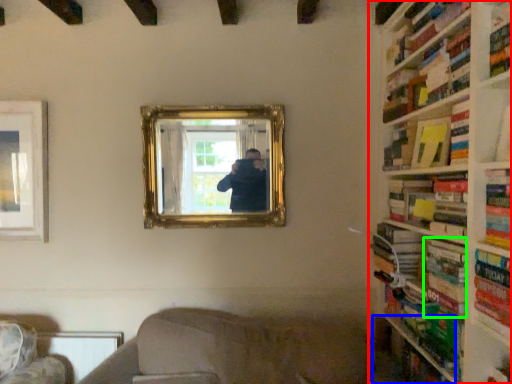
Question: Based on their relative distances, which object is nearer to bookcase (highlighted by a red box)? Choose from shelf (highlighted by a blue box) and book (highlighted by a green box).

Choices:
 (A) shelf
 (B) book

Answer: (B)